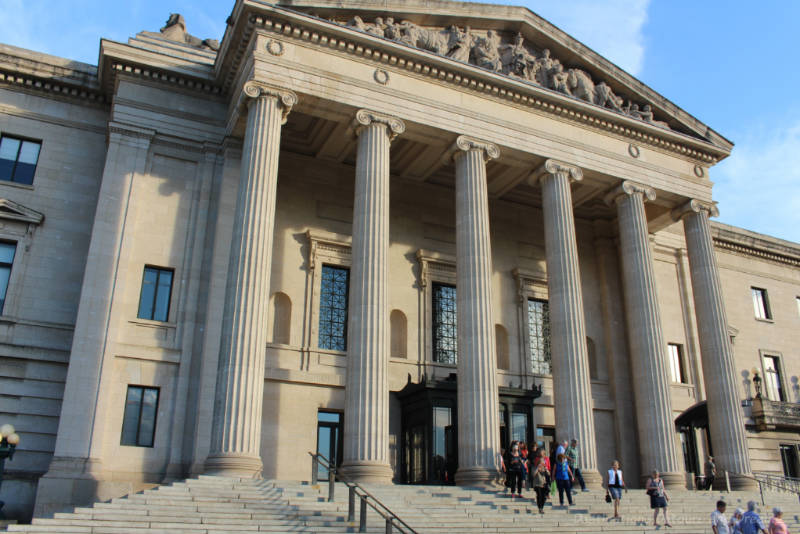
The image size is (800, 534). In order to click on top of railing in this screenshot , I will do `click(310, 449)`.